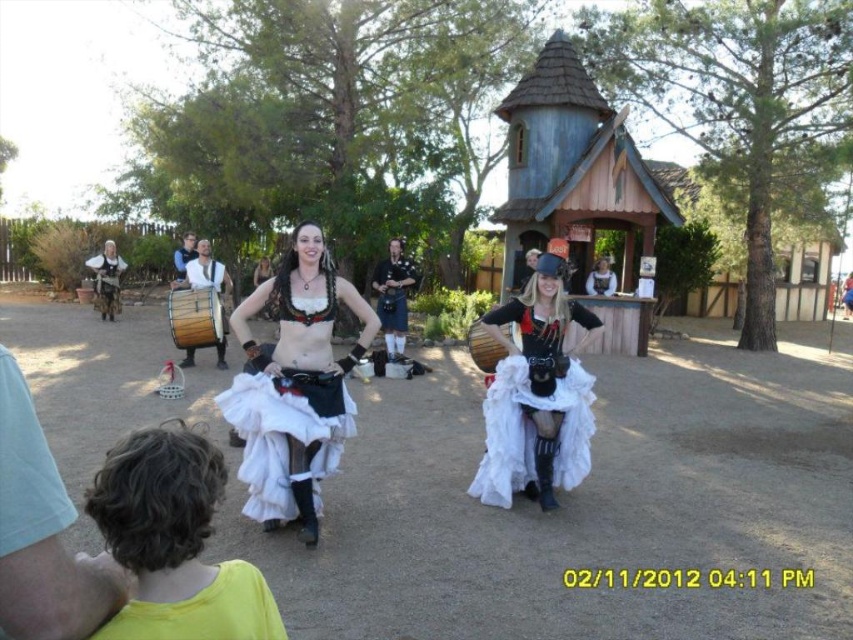
Question: Is yellow fabric shirt at lower left in front of matte black drum at center?

Choices:
 (A) yes
 (B) no

Answer: (A)

Question: Is white lace skirt at center smaller than white lace dress at center?

Choices:
 (A) no
 (B) yes

Answer: (A)

Question: Which is nearer to the white lace skirt at center?

Choices:
 (A) white tulle skirt at center
 (B) matte black drum at center
 (C) black leather kilt at center

Answer: (A)

Question: Among these points, which one is nearest to the camera?

Choices:
 (A) (363, 336)
 (B) (563, 371)
 (C) (595, 280)

Answer: (A)

Question: Does matte black drum at center have a lesser width compared to white lace dress at center?

Choices:
 (A) yes
 (B) no

Answer: (B)

Question: Based on their relative distances, which object is nearer to the white tulle skirt at center?

Choices:
 (A) black leather kilt at center
 (B) yellow fabric shirt at lower left
 (C) white lace skirt at center

Answer: (C)